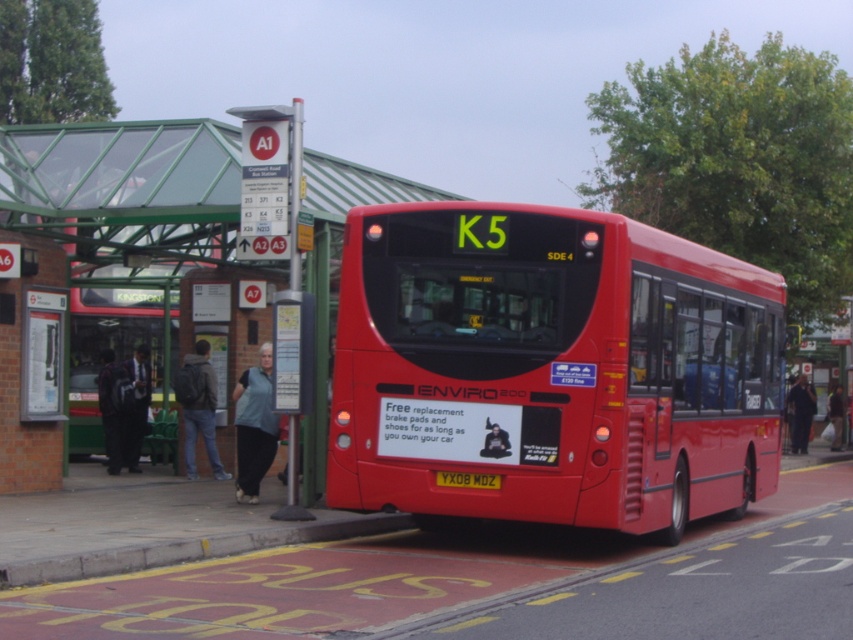
Question: Which of these objects is positioned farthest from the dark blue jeans at left?

Choices:
 (A) light blue fabric at center
 (B) matte black bus at left

Answer: (A)

Question: Which object is positioned closest to the matte black bus at left?

Choices:
 (A) light blue fabric at center
 (B) yellow metallic license plate at rear
 (C) matte red bus at center
 (D) dark blue jeans at left

Answer: (D)

Question: Is dark suit at left bigger than dark blue jeans at left?

Choices:
 (A) yes
 (B) no

Answer: (A)

Question: Does yellow painted concrete curb at lower center have a lesser width compared to dark blue jacket at center?

Choices:
 (A) no
 (B) yes

Answer: (A)

Question: Estimate the real-world distances between objects in this image. Which object is closer to the dark blue jacket at center?

Choices:
 (A) light blue fabric at center
 (B) denim jacket at lower left

Answer: (B)

Question: Is light blue fabric at center further to camera compared to dark gray jacket at center?

Choices:
 (A) no
 (B) yes

Answer: (A)